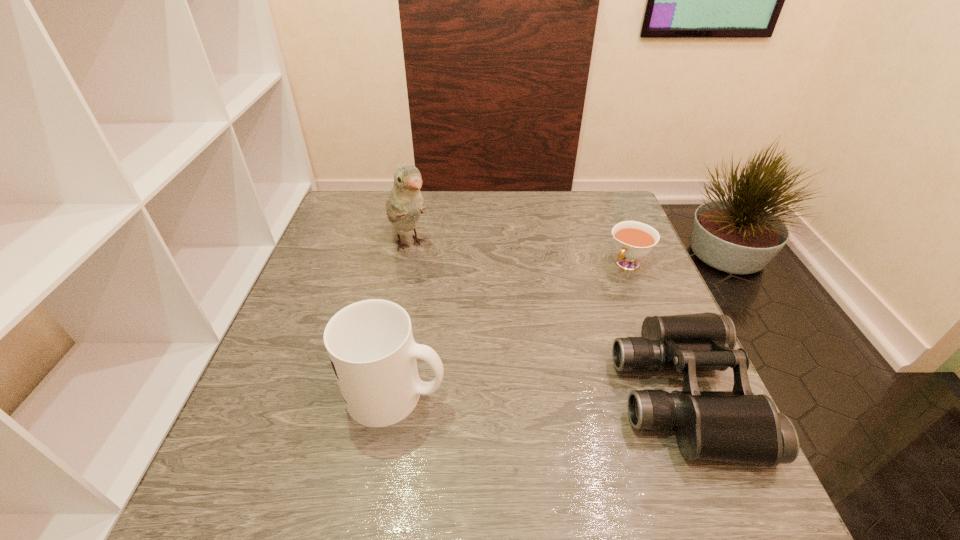
Identify the location of free region at the far left corner of the desktop. (358, 200).

I want to click on empty space that is in between the third shortest object and the third tallest object, so coord(539,394).

This screenshot has width=960, height=540. I want to click on free space between the second tallest object and the shortest object, so click(512, 329).

This screenshot has width=960, height=540. I want to click on unoccupied position between the second tallest object and the teacup, so click(512, 329).

I want to click on unoccupied area between the teacup and the tallest object, so click(x=518, y=254).

You are a GUI agent. You are given a task and a screenshot of the screen. Output one action in this format:
    pyautogui.click(x=<x>, y=<y>)
    Task: Click on the free point between the binoculars and the tallest object
    
    Given the screenshot: What is the action you would take?
    pyautogui.click(x=545, y=319)

Locate an element on the screen. This screenshot has height=540, width=960. vacant region between the bird and the binoculars is located at coordinates [545, 319].

At what (x,y) coordinates should I click in order to perform the action: click on vacant area that lies between the shortest object and the third shortest object. Please return your answer as a coordinate pair (x, y). This screenshot has width=960, height=540. Looking at the image, I should click on (512, 329).

Where is `object that is the closest to the tallest object`? This screenshot has height=540, width=960. object that is the closest to the tallest object is located at coordinates (370, 343).

Locate which object is the second closest to the binoculars. Please provide its 2D coordinates. Your answer should be formatted as a tuple, i.e. [(x, y)], where the tuple contains the x and y coordinates of a point satisfying the conditions above.

[(370, 343)]